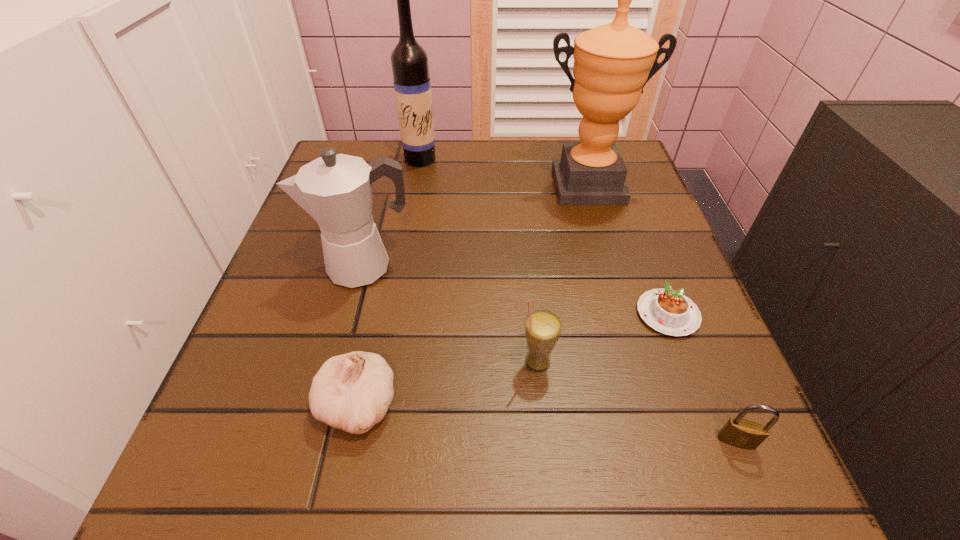
Find the location of `vacant space located 0.360m at the front of the award with handles`. vacant space located 0.360m at the front of the award with handles is located at coordinates click(632, 341).

Locate an element on the screen. This screenshot has width=960, height=540. blank area located on the label of the wine bottle is located at coordinates (416, 187).

The image size is (960, 540). What are the coordinates of `vacant space located on the front of the third farthest object` in the screenshot? It's located at (330, 398).

In order to click on free spot located 0.140m on the back of the fourth object from left to right in this screenshot , I will do `click(529, 284)`.

Find the location of a particular element. Image resolution: width=960 pixels, height=540 pixels. vacant space located 0.330m on the back of the garlic is located at coordinates (394, 231).

Image resolution: width=960 pixels, height=540 pixels. What are the coordinates of `vacant region located on the back of the padlock` in the screenshot? It's located at (668, 275).

Identify the location of vacant space located on the back of the pudding. Image resolution: width=960 pixels, height=540 pixels. (640, 243).

Where is `award positioned at the far edge`? The width and height of the screenshot is (960, 540). award positioned at the far edge is located at coordinates (612, 63).

Find the location of `wine bottle present at the far edge`. wine bottle present at the far edge is located at coordinates (412, 86).

Where is `object positioned at the near edge`? object positioned at the near edge is located at coordinates (737, 432).